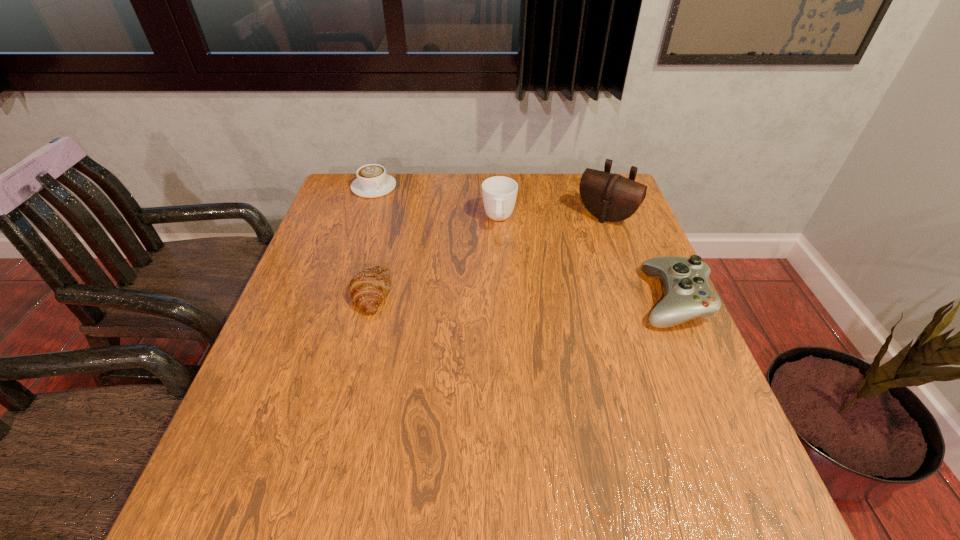
The width and height of the screenshot is (960, 540). What are the coordinates of `cappuccino that is at the left edge` in the screenshot? It's located at (372, 181).

You are a GUI agent. You are given a task and a screenshot of the screen. Output one action in this format:
    pyautogui.click(x=<x>, y=<y>)
    Task: Click on the control located at the right edge
    The height and width of the screenshot is (540, 960).
    Given the screenshot: What is the action you would take?
    pyautogui.click(x=687, y=295)

This screenshot has width=960, height=540. Identify the location of pouch situated at the right edge. (610, 197).

You are a GUI agent. You are given a task and a screenshot of the screen. Output one action in this format:
    pyautogui.click(x=<x>, y=<y>)
    Task: Click on the object situated at the far left corner
    The width and height of the screenshot is (960, 540).
    Given the screenshot: What is the action you would take?
    pyautogui.click(x=372, y=181)

The height and width of the screenshot is (540, 960). What are the coordinates of `object that is at the far right corner` in the screenshot? It's located at (610, 197).

Where is `vacant position at the far edge of the desktop`? Image resolution: width=960 pixels, height=540 pixels. vacant position at the far edge of the desktop is located at coordinates (537, 190).

Find the location of a particular element. free region at the left edge of the desktop is located at coordinates (356, 251).

This screenshot has height=540, width=960. I want to click on free region at the right edge, so click(624, 289).

You are a GUI agent. You are given a task and a screenshot of the screen. Output one action in this format:
    pyautogui.click(x=<x>, y=<y>)
    Task: Click on the blank space at the far left corner of the desktop
    
    Given the screenshot: What is the action you would take?
    pyautogui.click(x=348, y=185)

Identify the location of vacant area at the near left corner. (275, 423).